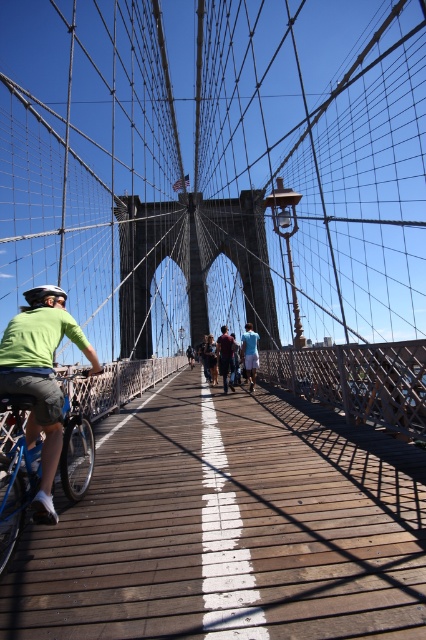
Question: Where is maroon fabric shirt at center located in relation to blue fabric shirt at center in the image?

Choices:
 (A) above
 (B) below

Answer: (B)

Question: Which point is closer to the camera?

Choices:
 (A) blue fabric shirt at center
 (B) maroon fabric shirt at center
 (C) matte black helmet at left

Answer: (C)

Question: Does blue jeans at center have a smaller size compared to blue fabric shirt at center?

Choices:
 (A) no
 (B) yes

Answer: (A)

Question: Among these objects, which one is nearest to the camera?

Choices:
 (A) maroon fabric shirt at center
 (B) blue jeans at center
 (C) blue metallic bicycle at left

Answer: (C)

Question: Among these objects, which one is nearest to the camera?

Choices:
 (A) matte black helmet at left
 (B) blue fabric shirt at center

Answer: (A)

Question: Is blue metallic bicycle at left to the left of maroon fabric shirt at center from the viewer's perspective?

Choices:
 (A) no
 (B) yes

Answer: (B)